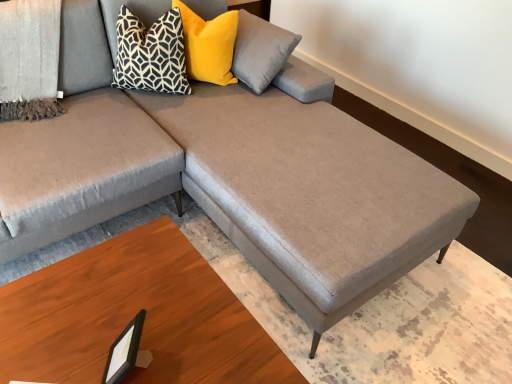
Locate an element on the screen. The width and height of the screenshot is (512, 384). empty space that is ontop of wooden table at lower right (from a real-world perspective) is located at coordinates (118, 312).